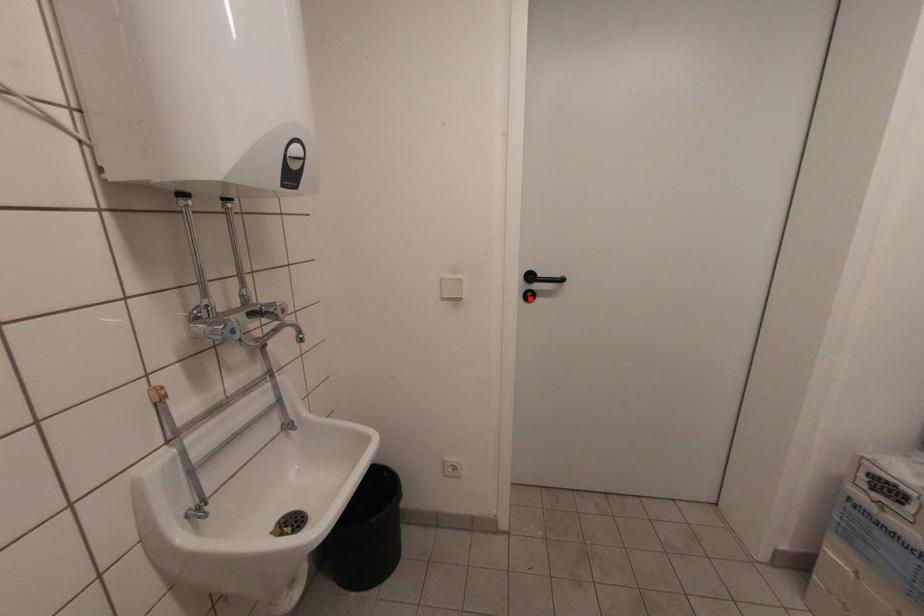
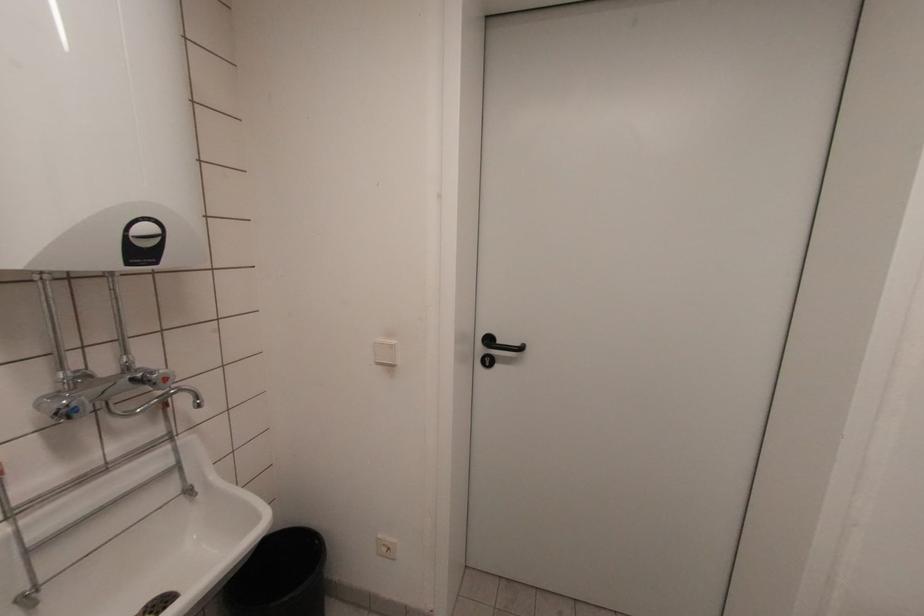
Find the pixel in the second image that matches the highlighted location in the first image.

(488, 363)